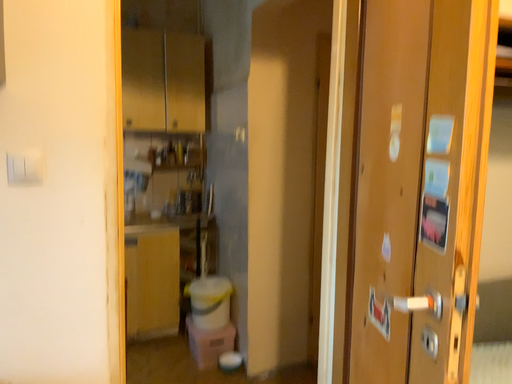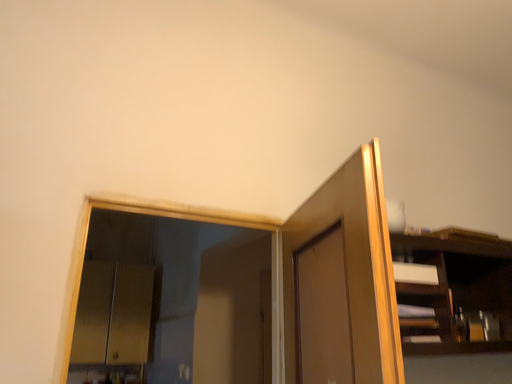
Question: Which way did the camera rotate in the video?

Choices:
 (A) rotated left
 (B) rotated right

Answer: (B)